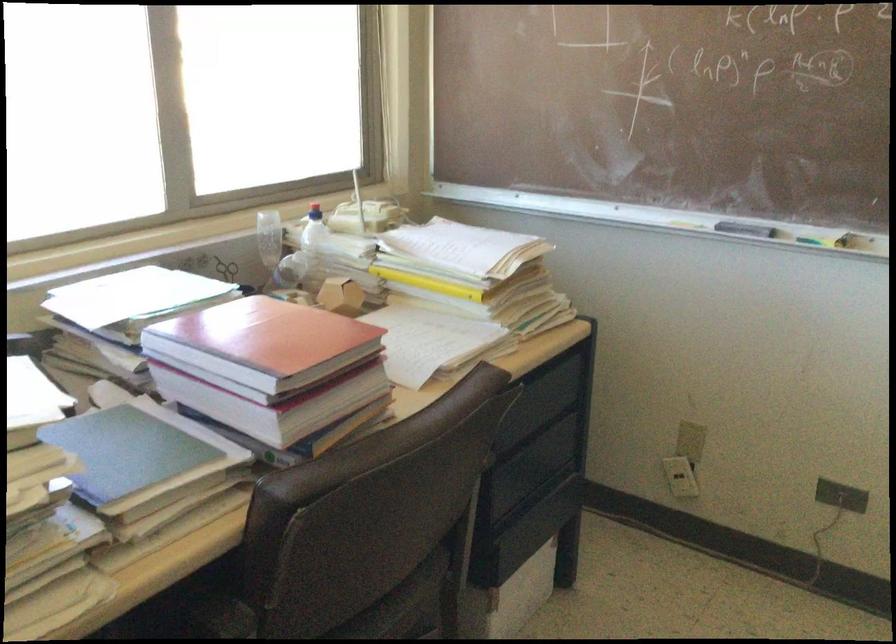
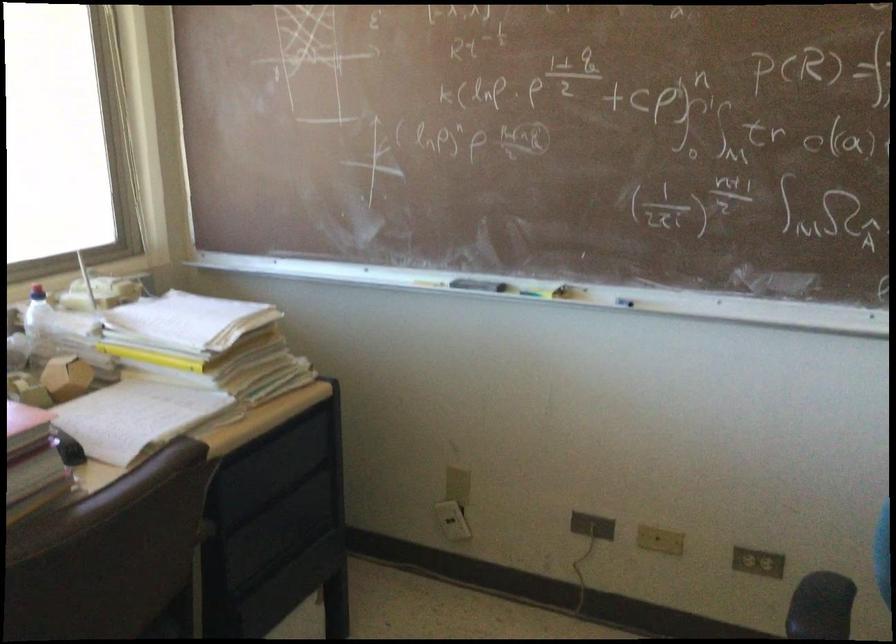
Find the pixel in the second image that matches the point at 819,237 in the first image.

(538, 289)